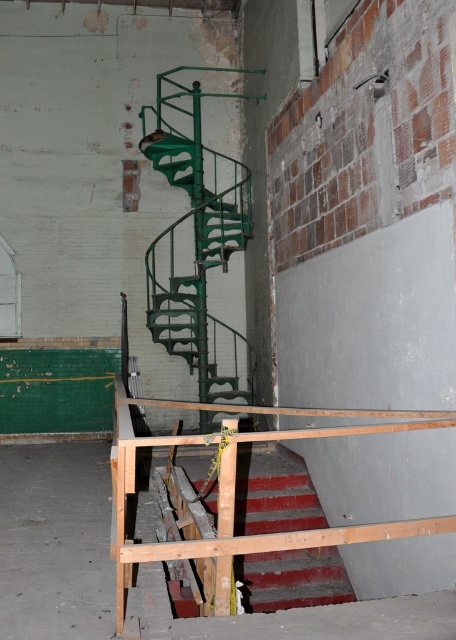
You are an architect inspecting the building and need to compare the height of the green matte spiral staircase at center and the red textured stair at lower center. Based on the scene, which one is taller?

The green matte spiral staircase at center is taller than the red textured stair at lower center according to the description.

You are an architect inspecting a building site. You notice the green matte spiral staircase at center and the red textured stair at lower center. Which object would require more materials to construct, considering their size?

The green matte spiral staircase at center requires more materials to construct because it is larger in size than the red textured stair at lower center.